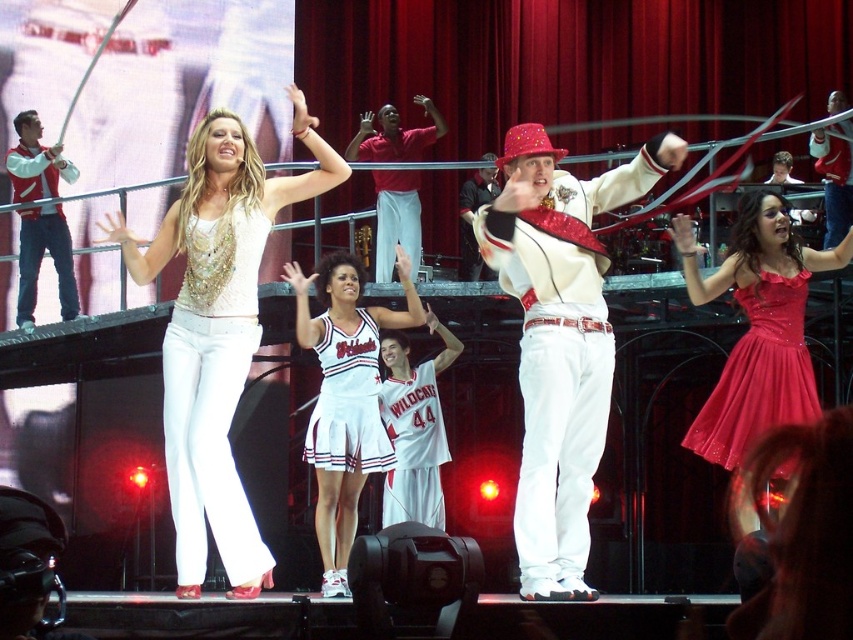
Question: Is shiny white pants at center bigger than white fabric cheerleader skirt at center?

Choices:
 (A) no
 (B) yes

Answer: (B)

Question: Is white fabric cheerleader skirt at center positioned before white fabric cheerleader outfit at center?

Choices:
 (A) yes
 (B) no

Answer: (A)

Question: Considering the relative positions of shiny sequined top at center and white fabric cheerleader skirt at center in the image provided, where is shiny sequined top at center located with respect to white fabric cheerleader skirt at center?

Choices:
 (A) below
 (B) above

Answer: (B)

Question: Which object appears closest to the camera in this image?

Choices:
 (A) white fabric cheerleader outfit at center
 (B) shiny white pants at center
 (C) shiny sequined top at center
 (D) matte red vest at left

Answer: (B)

Question: Estimate the real-world distances between objects in this image. Which object is farther from the shiny white pants at center?

Choices:
 (A) matte red vest at left
 (B) white fabric cheerleader skirt at center

Answer: (A)

Question: Which object is the farthest from the shiny red dress at center?

Choices:
 (A) white fabric cheerleader skirt at center
 (B) shiny white pants at center
 (C) shiny red dress at right
 (D) shiny sequined top at center

Answer: (D)